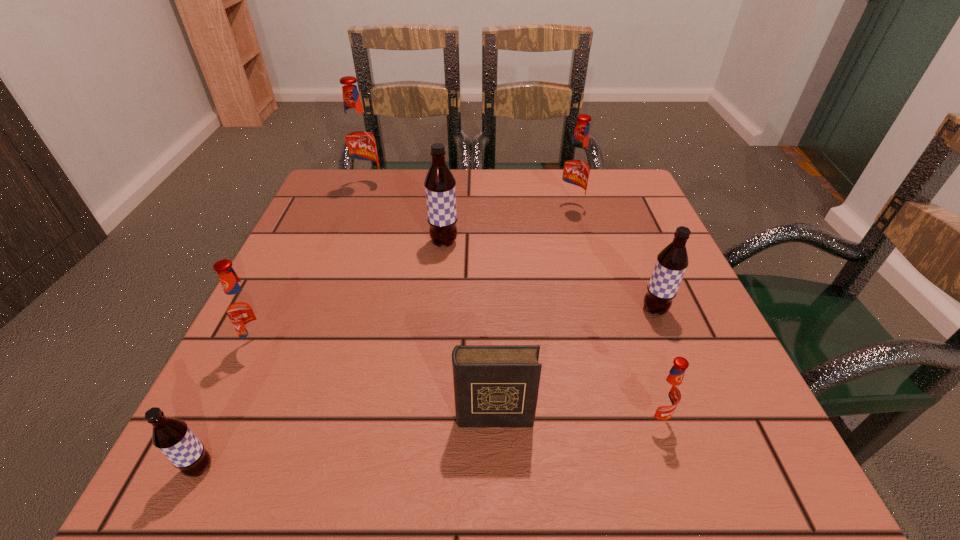
The width and height of the screenshot is (960, 540). I want to click on free spot between the fourth nearest root beer and the fifth object from left to right, so pos(574,363).

The image size is (960, 540). What are the coordinates of `vacant region between the second nearest root beer and the second farthest root beer` in the screenshot? It's located at (612, 313).

Locate an element on the screen. The image size is (960, 540). empty location between the nearest red root beer and the biggest red root beer is located at coordinates (512, 302).

You are a GUI agent. You are given a task and a screenshot of the screen. Output one action in this format:
    pyautogui.click(x=<x>, y=<y>)
    Task: Click on the object that is the closest to the third nearest red root beer
    This screenshot has width=960, height=540.
    Given the screenshot: What is the action you would take?
    pyautogui.click(x=440, y=189)

Where is `object that is the second nearest to the dark diary`? The width and height of the screenshot is (960, 540). object that is the second nearest to the dark diary is located at coordinates (672, 261).

Locate an element on the screen. The height and width of the screenshot is (540, 960). the sixth closest root beer to the third red root beer from right to left is located at coordinates (666, 394).

Image resolution: width=960 pixels, height=540 pixels. What are the coordinates of `root beer that is the sixth closest one to the nearest brown root beer` in the screenshot? It's located at (576, 167).

Find the location of a particular element. The height and width of the screenshot is (540, 960). red root beer identified as the third closest to the sixth farthest root beer is located at coordinates (359, 140).

Locate which red root beer is the fourth closest to the diary. Please provide its 2D coordinates. Your answer should be formatted as a tuple, i.e. [(x, y)], where the tuple contains the x and y coordinates of a point satisfying the conditions above.

[(359, 140)]

What are the coordinates of `the second closest brown root beer to the diary` in the screenshot? It's located at (172, 436).